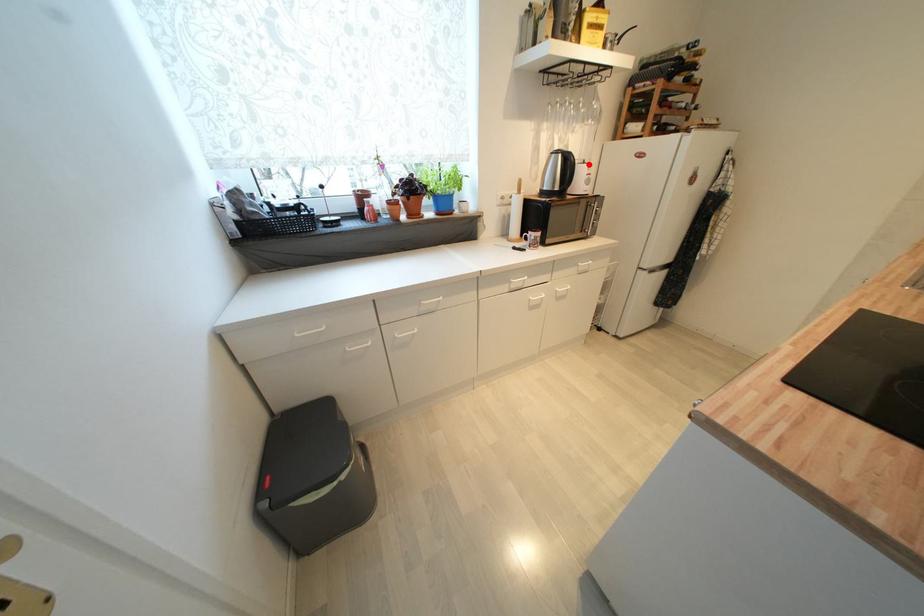
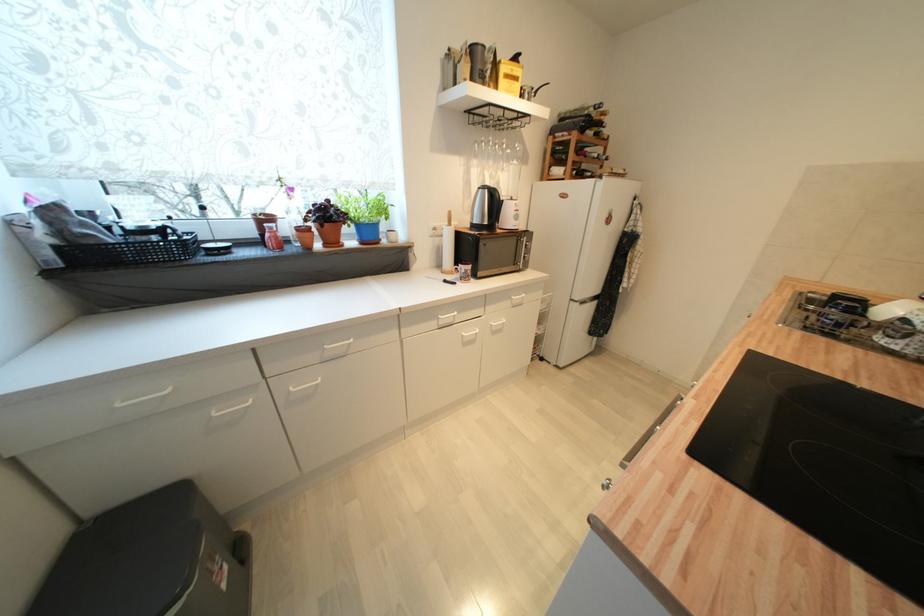
Find the pixel in the second image that matches the highlighted location in the first image.

(517, 201)